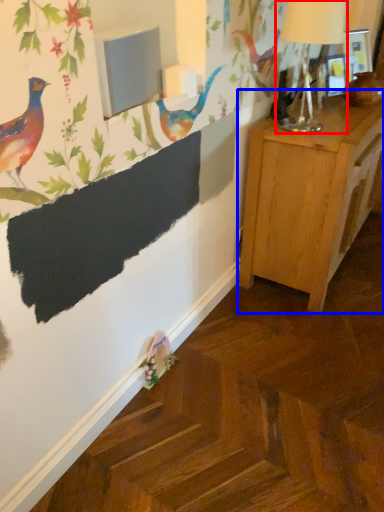
Question: Among these objects, which one is nearest to the camera, table lamp (highlighted by a red box) or nightstand (highlighted by a blue box)?

Choices:
 (A) table lamp
 (B) nightstand

Answer: (A)